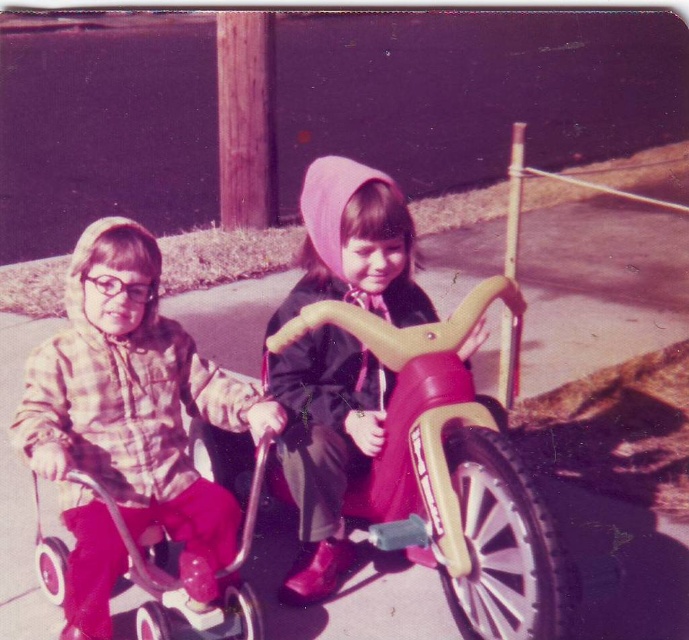
Question: Can you confirm if plaid fabric shirt at left is smaller than matte yellow tricycle at center?

Choices:
 (A) no
 (B) yes

Answer: (A)

Question: Among these objects, which one is farthest from the camera?

Choices:
 (A) plaid fabric shirt at left
 (B) matte yellow tricycle at center

Answer: (B)

Question: Which point appears closest to the camera in this image?

Choices:
 (A) (156, 326)
 (B) (477, 340)

Answer: (B)

Question: Can you confirm if plaid fabric shirt at left is positioned to the left of matte yellow tricycle at center?

Choices:
 (A) yes
 (B) no

Answer: (A)

Question: Can you confirm if plaid fabric shirt at left is smaller than matte yellow tricycle at center?

Choices:
 (A) no
 (B) yes

Answer: (A)